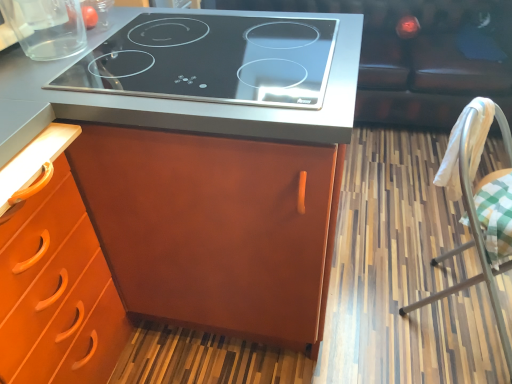
Find the location of a particular element. vacant region above matte wood cabinet at center (from a real-world perspective) is located at coordinates (125, 62).